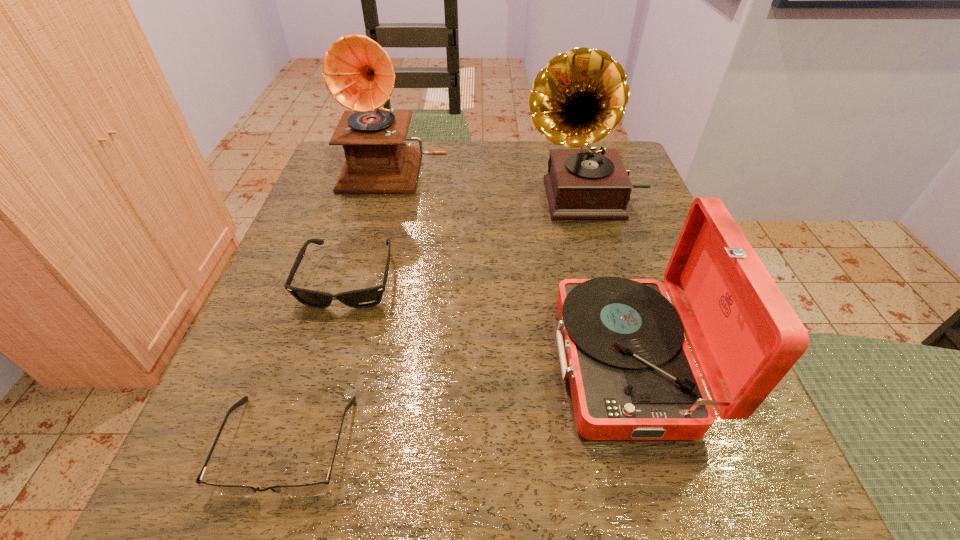
Choose which phonograph_record is the third nearest neighbor to the spectacles. Please provide its 2D coordinates. Your answer should be formatted as a tuple, i.e. [(x, y)], where the tuple contains the x and y coordinates of a point satisfying the conditions above.

[(358, 73)]

You are a GUI agent. You are given a task and a screenshot of the screen. Output one action in this format:
    pyautogui.click(x=<x>, y=<y>)
    Task: Click on the second closest phonograph_record to the second shortest object
    Image resolution: width=960 pixels, height=540 pixels.
    Given the screenshot: What is the action you would take?
    pos(580,96)

Locate an element on the screen. free space in the image that satisfies the following two spatial constraints: 1. on the front-facing side of the nearest phonograph_record; 2. on the front-facing side of the spectacles is located at coordinates (651, 446).

You are a GUI agent. You are given a task and a screenshot of the screen. Output one action in this format:
    pyautogui.click(x=<x>, y=<y>)
    Task: Click on the free point that satisfies the following two spatial constraints: 1. on the front-facing side of the shortest phonograph_record; 2. on the front-facing side of the spectacles
    The width and height of the screenshot is (960, 540).
    Given the screenshot: What is the action you would take?
    pyautogui.click(x=651, y=446)

What are the coordinates of `vacant region that satisfies the following two spatial constraints: 1. on the front-facing side of the nearest phonograph_record; 2. on the front-facing side of the shortest object` in the screenshot? It's located at (651, 446).

The image size is (960, 540). In order to click on free space that satisfies the following two spatial constraints: 1. on the front-facing side of the nearest phonograph_record; 2. on the front-facing side of the shortest object in this screenshot , I will do `click(651, 446)`.

The width and height of the screenshot is (960, 540). Find the location of `free spot that satisfies the following two spatial constraints: 1. on the front-facing side of the nearest phonograph_record; 2. on the front-facing side of the shortest object`. free spot that satisfies the following two spatial constraints: 1. on the front-facing side of the nearest phonograph_record; 2. on the front-facing side of the shortest object is located at coordinates (651, 446).